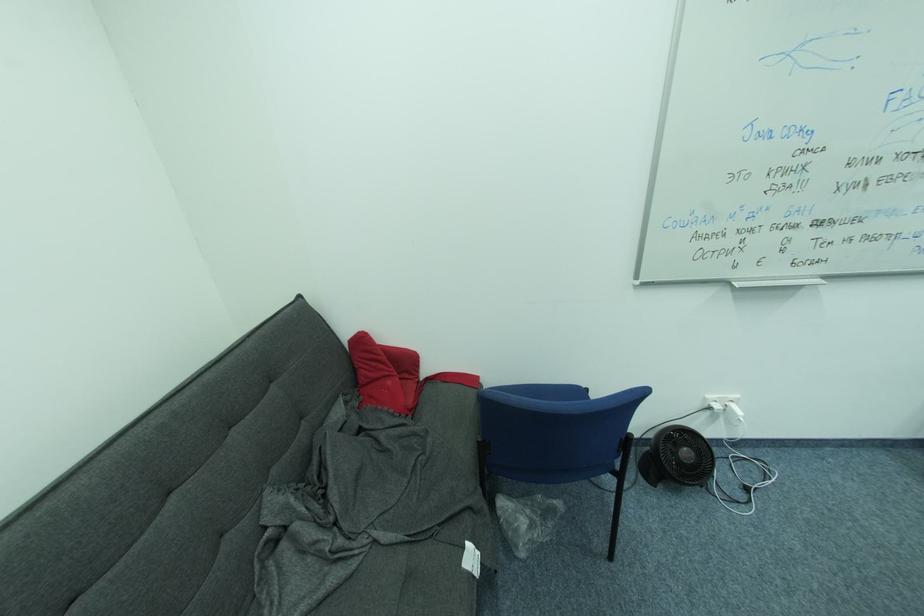
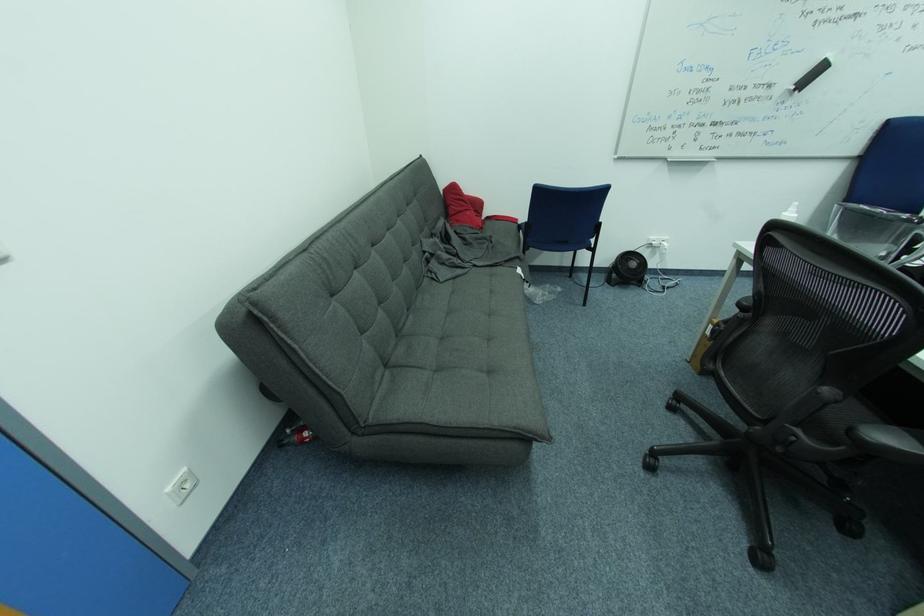
Question: I am providing you with two images of the same scene from different viewpoints. Please identify which objects are invisible in image2.

Choices:
 (A) white spray bottle
 (B) red pillow
 (C) grey sofa sitting surface
 (D) none of these

Answer: (D)